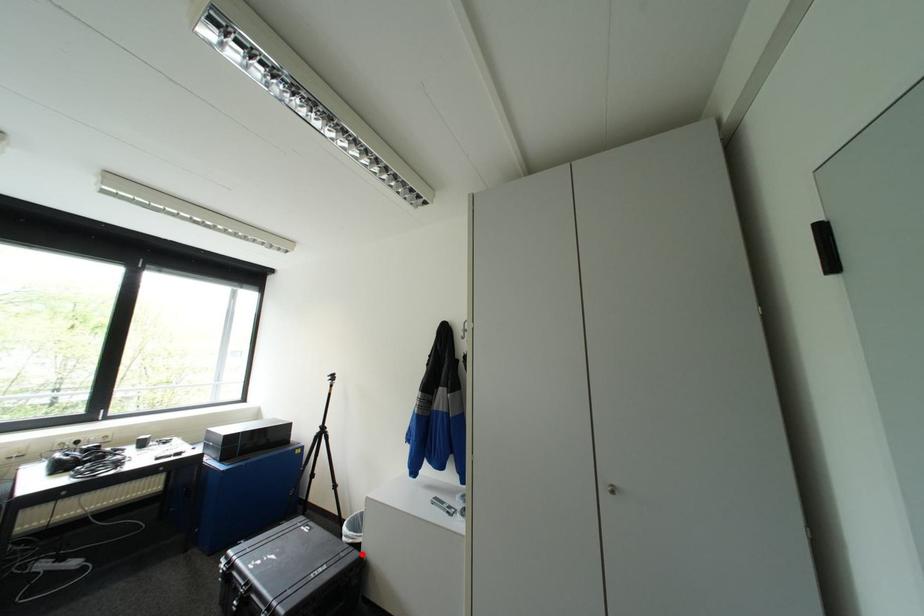
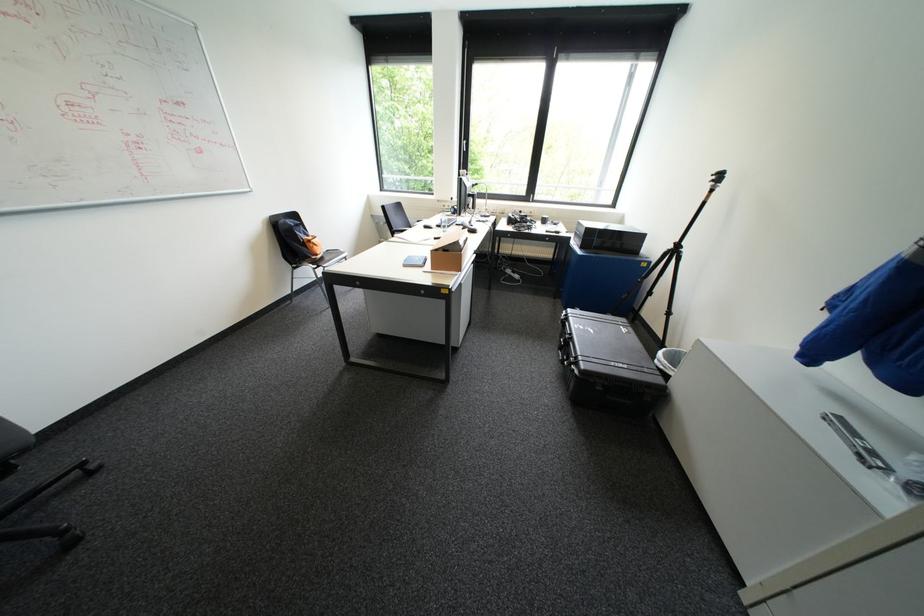
The point at the highlighted location is marked in the first image. Where is the corresponding point in the second image?

(666, 379)